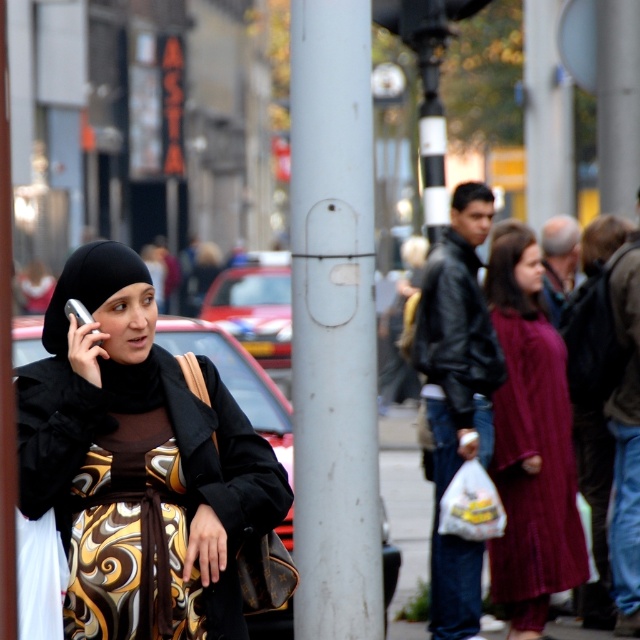
Can you confirm if white matte pole at center is smaller than maroon textured dress at center?

Yes.

Between point (316, 525) and point (541, 362), which one is positioned in front?

Positioned in front is point (316, 525).

This screenshot has width=640, height=640. What do you see at coordinates (333, 323) in the screenshot?
I see `white matte pole at center` at bounding box center [333, 323].

Find the location of `white matte pole at center`. white matte pole at center is located at coordinates (333, 323).

Who is positioned more to the left, white matte pole at center or gold patterned dress at center?

Positioned to the left is gold patterned dress at center.

Which is below, white matte pole at center or gold patterned dress at center?

gold patterned dress at center is lower down.

Is point (358, 444) more distant than point (124, 424)?

That is True.

Identify the location of white matte pole at center. (333, 323).

Which is behind, point (200, 593) or point (108, 465)?

Point (200, 593)

Who is shorter, matte black hijab at center or gold patterned dress at center?

Standing shorter between the two is gold patterned dress at center.

At what (x,y) coordinates should I click in order to perform the action: click on matte black hijab at center. Please return your answer as a coordinate pair (x, y). The image size is (640, 640). Looking at the image, I should click on (134, 468).